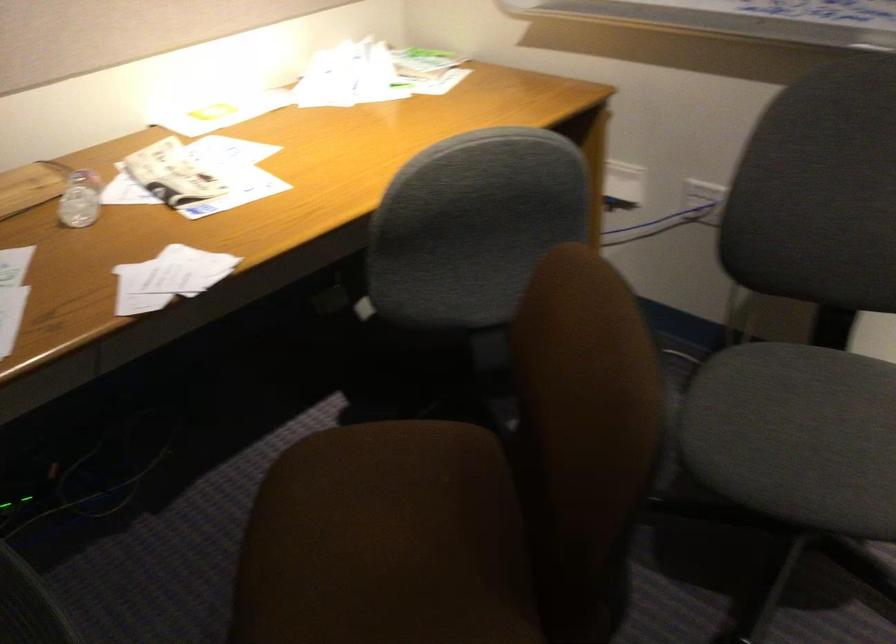
Where is `brown chair sitting surface`? The image size is (896, 644). brown chair sitting surface is located at coordinates (385, 542).